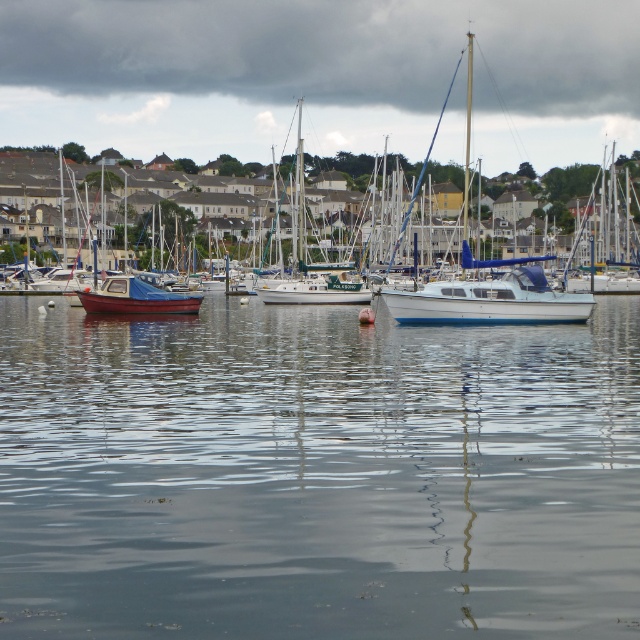
Consider the image. Is white glossy boat at center shorter than matte blue sailboat at left?

In fact, white glossy boat at center may be taller than matte blue sailboat at left.

This screenshot has width=640, height=640. In order to click on white glossy boat at center in this screenshot , I will do `click(490, 301)`.

Where is `white glossy boat at center`? The width and height of the screenshot is (640, 640). white glossy boat at center is located at coordinates pos(490,301).

Can you confirm if white glossy sailboat at center is bigger than matte blue sailboat at left?

Correct, white glossy sailboat at center is larger in size than matte blue sailboat at left.

Is point (396, 296) more distant than point (138, 285)?

No, (396, 296) is closer to viewer.

Locate an element on the screen. The width and height of the screenshot is (640, 640). white glossy sailboat at center is located at coordinates (490, 301).

Does clear water at center come in front of matte blue sailboat at left?

Yes.

How far apart are clear water at center and matte blue sailboat at left?

A distance of 13.26 meters exists between clear water at center and matte blue sailboat at left.

The width and height of the screenshot is (640, 640). Identify the location of clear water at center. (316, 474).